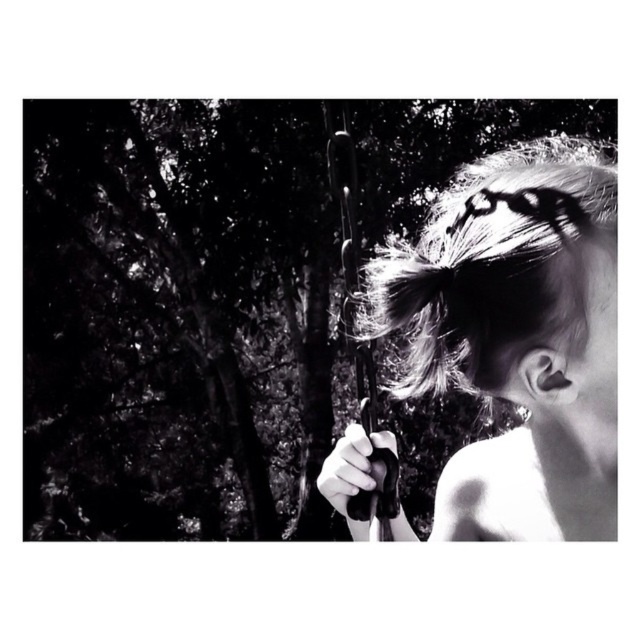
Question: Is dark textured tree at upper left behind shiny black hair at right?

Choices:
 (A) no
 (B) yes

Answer: (B)

Question: Which of the following is the farthest from the observer?

Choices:
 (A) dark textured tree at upper left
 (B) shiny black hair at right

Answer: (A)

Question: Which object appears farthest from the camera in this image?

Choices:
 (A) shiny black hair at right
 (B) dark textured tree at upper left

Answer: (B)

Question: Can you confirm if dark textured tree at upper left is bigger than shiny black hair at right?

Choices:
 (A) no
 (B) yes

Answer: (B)

Question: Does dark textured tree at upper left have a larger size compared to shiny black hair at right?

Choices:
 (A) yes
 (B) no

Answer: (A)